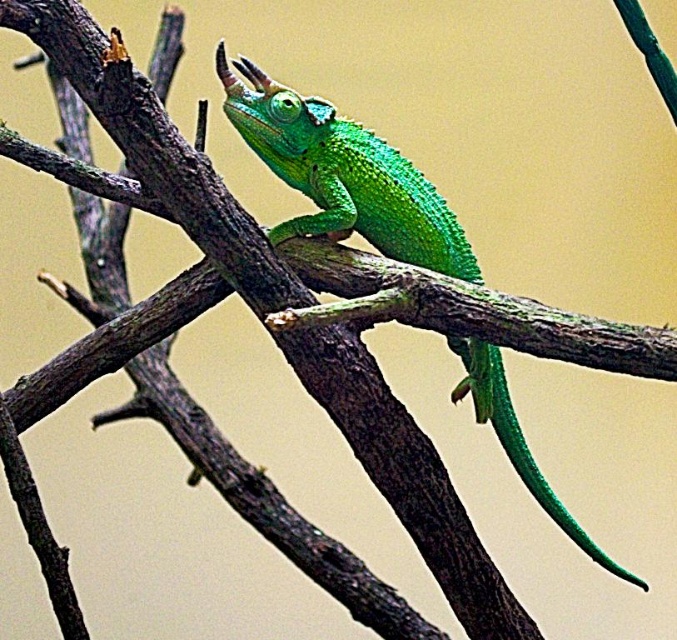
Question: Which point is closer to the camera?

Choices:
 (A) green scaly lizard at center
 (B) green scaly tail at center

Answer: (A)

Question: Can you confirm if green scaly lizard at center is positioned above green scaly tail at center?

Choices:
 (A) no
 (B) yes

Answer: (B)

Question: Does green scaly lizard at center lie in front of green scaly tail at center?

Choices:
 (A) yes
 (B) no

Answer: (A)

Question: Is green scaly lizard at center thinner than green scaly tail at center?

Choices:
 (A) no
 (B) yes

Answer: (A)